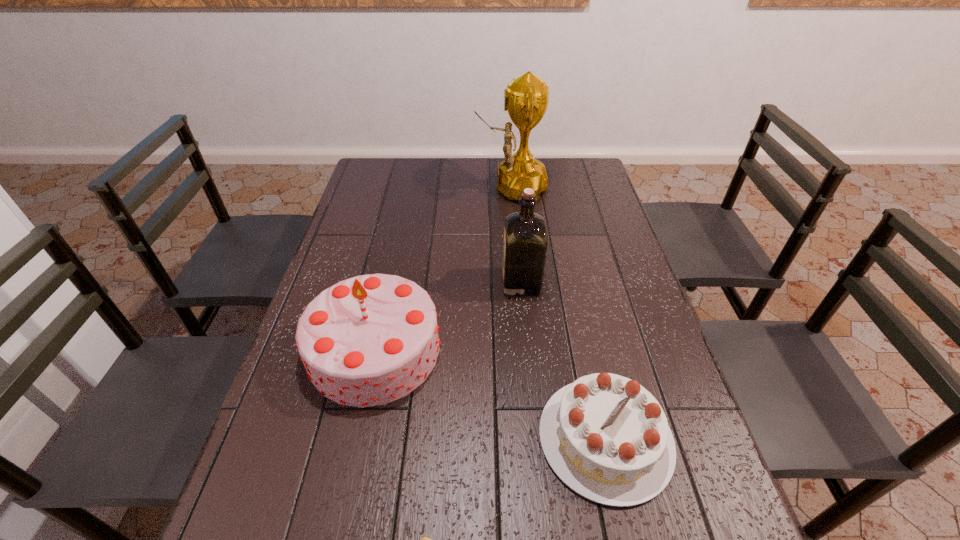
This screenshot has width=960, height=540. What are the coordinates of `vacant space situated on the front side of the farthest object` in the screenshot? It's located at (365, 188).

Find the location of a particular element. free region located 0.160m on the label of the liquor is located at coordinates (446, 282).

Find the location of `free space located 0.070m on the label of the liquor`. free space located 0.070m on the label of the liquor is located at coordinates (478, 282).

Identify the location of vacant space located on the label of the liquor. (396, 282).

What are the coordinates of `free space located on the right of the left birthday cake` in the screenshot? It's located at (544, 349).

This screenshot has width=960, height=540. Identify the location of free location located on the left of the shorter birthday cake. (505, 438).

This screenshot has height=540, width=960. What are the coordinates of `object that is at the far edge` in the screenshot? It's located at (526, 98).

The width and height of the screenshot is (960, 540). I want to click on object situated at the left edge, so click(x=369, y=340).

What are the coordinates of `object that is positioned at the right edge` in the screenshot? It's located at (605, 436).

You are a GUI agent. You are given a task and a screenshot of the screen. Output one action in this format:
    pyautogui.click(x=<x>, y=<y>)
    Task: Click on the vacant space at the far edge
    The height and width of the screenshot is (540, 960).
    Given the screenshot: What is the action you would take?
    pyautogui.click(x=462, y=158)